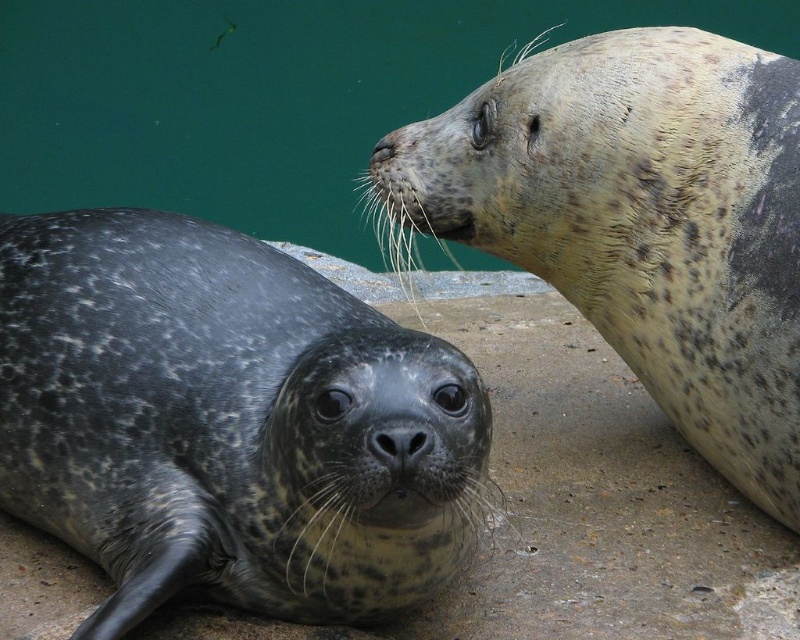
Is point (232, 301) more distant than point (588, 36)?

No, it is in front of (588, 36).

Does spotted fur seal at lower left appear under speckled fur seal at upper right?

Indeed, spotted fur seal at lower left is positioned under speckled fur seal at upper right.

Is point (260, 257) positioned before point (533, 60)?

Yes, point (260, 257) is closer to viewer.

Where is `spotted fur seal at lower left`? spotted fur seal at lower left is located at coordinates (224, 420).

Is speckled fur seal at upper right above matte gray seal at upper center?

No, speckled fur seal at upper right is not above matte gray seal at upper center.

The image size is (800, 640). What do you see at coordinates (644, 220) in the screenshot? I see `speckled fur seal at upper right` at bounding box center [644, 220].

Where is `speckled fur seal at upper right`? speckled fur seal at upper right is located at coordinates [x=644, y=220].

Is spotted fur seal at lower left in front of black matte nose at center?

No, it is behind black matte nose at center.

Between spotted fur seal at lower left and black matte nose at center, which one appears on the left side from the viewer's perspective?

spotted fur seal at lower left

Which is in front, point (202, 566) or point (410, 440)?

Positioned in front is point (410, 440).

Locate an element on the screen. spotted fur seal at lower left is located at coordinates (224, 420).